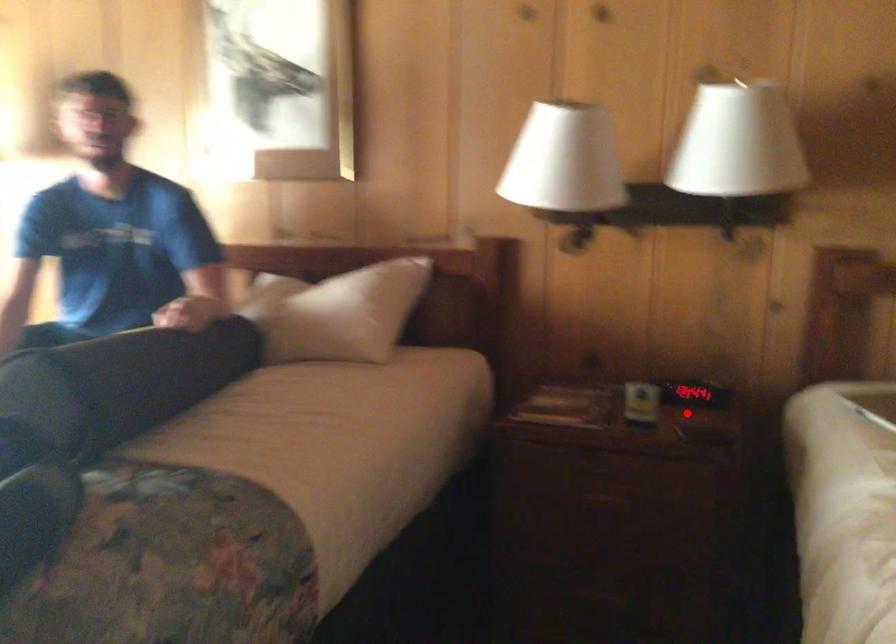
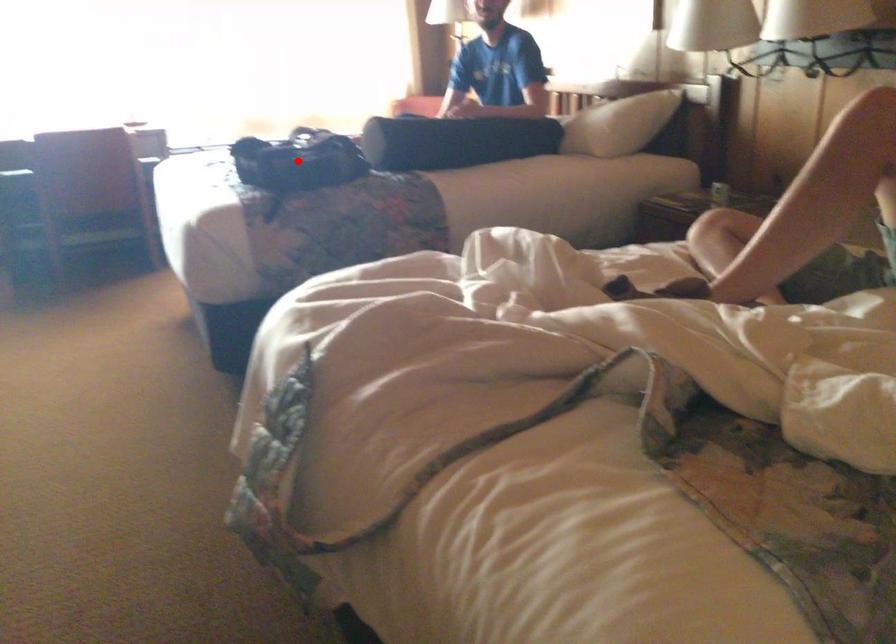
Looking at this image, I am providing you with two images of the same scene from different viewpoints. A red point is marked on the first image and another point is marked on the second image. Are the points marked in image1 and image2 representing the same 3D position?

No